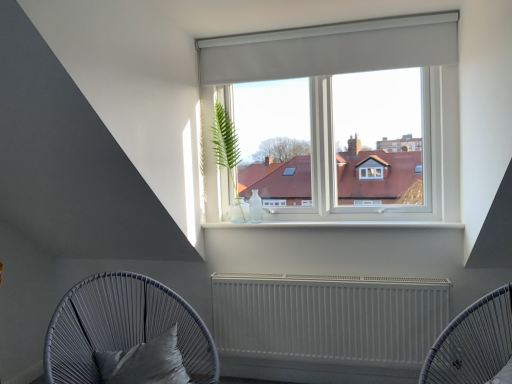
Question: Considering the positions of white matte radiator at lower center, arranged as the 2th furniture when viewed from the left, and satin black pillow at lower left in the image, is white matte radiator at lower center, arranged as the 2th furniture when viewed from the left, taller or shorter than satin black pillow at lower left?

Choices:
 (A) short
 (B) tall

Answer: (B)

Question: From a real-world perspective, relative to satin black pillow at lower left, is white matte radiator at lower center, arranged as the 2th furniture when viewed from the left, vertically above or below?

Choices:
 (A) above
 (B) below

Answer: (A)

Question: Which object is positioned farthest from the green leafy plant in glass vase at upper left?

Choices:
 (A) satin black pillow at lower left
 (B) white matte radiator at center
 (C) matte grey wicker chair with cushion at lower left, the first furniture from the left
 (D) white matte radiator at lower center, positioned as the 1th furniture in right-to-left order

Answer: (D)

Question: Which object is positioned closest to the white matte radiator at lower center, arranged as the 2th furniture when viewed from the left?

Choices:
 (A) green leafy plant in glass vase at upper left
 (B) matte grey wicker chair with cushion at lower left, acting as the 2th furniture starting from the right
 (C) white matte radiator at center
 (D) satin black pillow at lower left

Answer: (C)